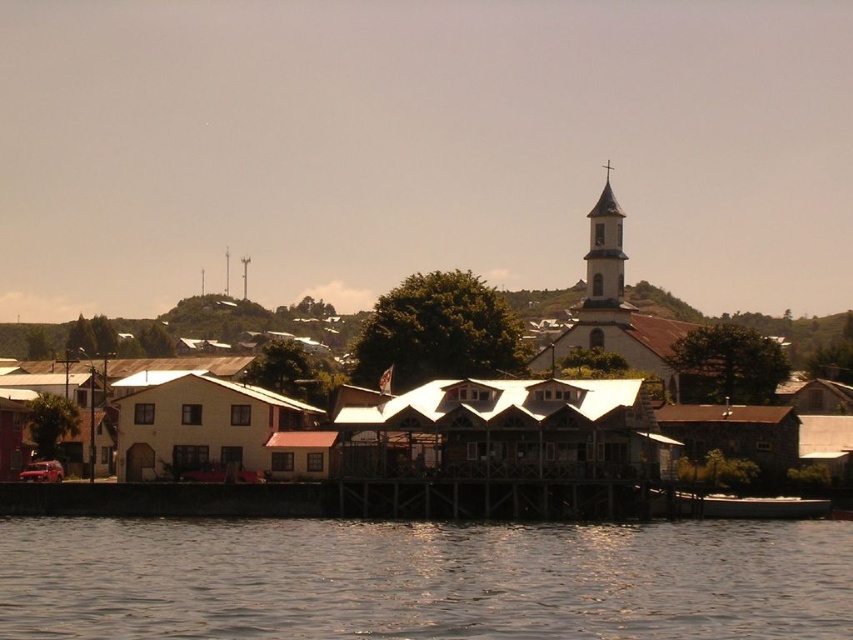
Question: Among these objects, which one is nearest to the camera?

Choices:
 (A) brown wooden dock at center
 (B) brown water at lower center

Answer: (B)

Question: Does brown wooden dock at center appear over metallic spire at upper center?

Choices:
 (A) yes
 (B) no

Answer: (B)

Question: Which object is closer to the camera taking this photo?

Choices:
 (A) white stucco bell tower at upper center
 (B) brushed metal spire at upper center
 (C) yellow wooden houses at center

Answer: (C)

Question: Does brown water at lower center have a lesser width compared to metallic spire at upper center?

Choices:
 (A) no
 (B) yes

Answer: (A)

Question: Which point appears closest to the camera in this image?

Choices:
 (A) (242, 296)
 (B) (602, 424)
 (C) (432, 493)

Answer: (B)

Question: Is yellow wooden houses at center behind metallic spire at upper center?

Choices:
 (A) no
 (B) yes

Answer: (A)